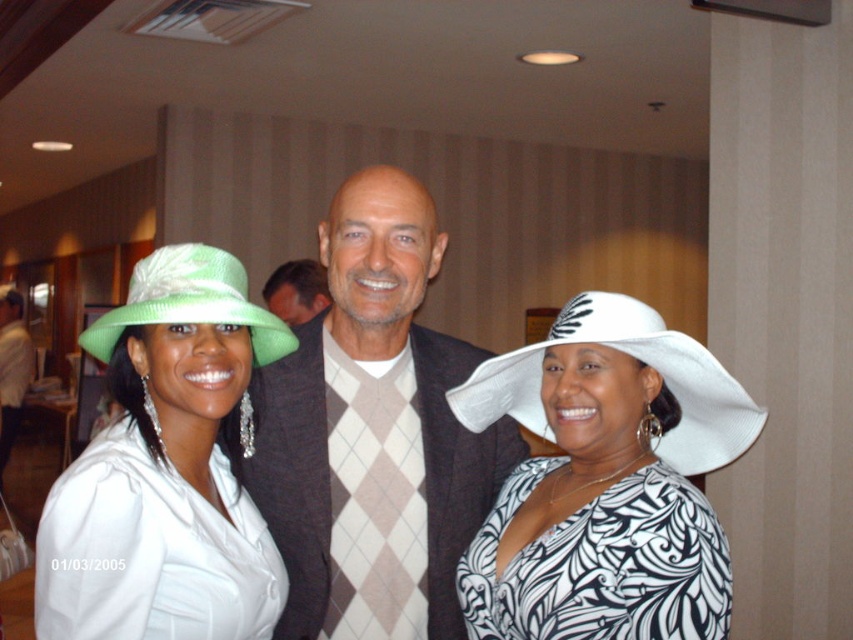
You are standing in the room and want to determine which of the two points is nearer to you. The points are labeled as point (x=112, y=472) and point (x=236, y=262). Which point is closer to your position?

Point (x=112, y=472) is closer to the viewer than point (x=236, y=262).

You are a photographer at the event and need to adjust the lighting to ensure both the matte green fabric hat at left and the green woven hat at left are clearly visible. Which hat is positioned lower on the person, requiring more downward lighting adjustment?

The matte green fabric hat at left is below the green woven hat at left, so it is positioned lower and would require more downward lighting adjustment to ensure visibility.